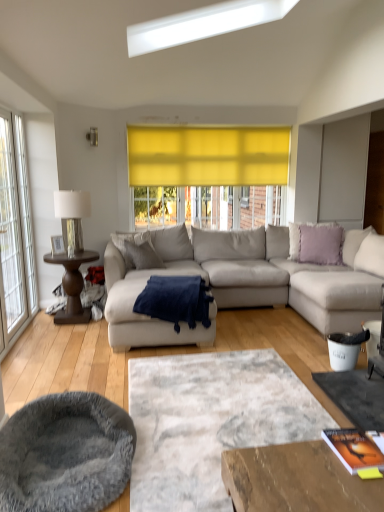
Identify the location of metallic silver lamp at left. The image size is (384, 512). (72, 215).

Image resolution: width=384 pixels, height=512 pixels. What do you see at coordinates (72, 286) in the screenshot?
I see `brown wood side table at left` at bounding box center [72, 286].

What do you see at coordinates (138, 250) in the screenshot?
I see `gray fabric pillow at center, which is the first pillow in left-to-right order` at bounding box center [138, 250].

I want to click on navy blue plush blanket at center, so click(x=175, y=300).

Identify the location of gray plush cat bed at lower left. (65, 454).

The image size is (384, 512). What do you see at coordinates (252, 283) in the screenshot?
I see `light gray fabric couch at center` at bounding box center [252, 283].

Locate an element on the screen. metallic silver lamp at left is located at coordinates (72, 215).

Which of these two, light gray fabric couch at center or textured gray rug at center, stands taller?

With more height is light gray fabric couch at center.

In the scene shown: From the image's perspective, would you say light gray fabric couch at center is shown under textured gray rug at center?

No, from the image's perspective, light gray fabric couch at center is not below textured gray rug at center.

Is textured gray rug at center completely or partially inside light gray fabric couch at center?

Definitely not — textured gray rug at center is not inside light gray fabric couch at center.

Considering the relative sizes of brown wood side table at left and gray fabric pillow at center, which is the 2th pillow from right to left, in the image provided, is brown wood side table at left bigger than gray fabric pillow at center, which is the 2th pillow from right to left,?

Yes.

Is point (60, 262) closer to viewer compared to point (132, 242)?

Yes, it is in front of point (132, 242).

In the scene shown: How different are the orientations of brown wood side table at left and gray fabric pillow at center, which is the 2th pillow from right to left, in degrees?

The angular difference between brown wood side table at left and gray fabric pillow at center, which is the 2th pillow from right to left, is 29.4 degrees.

Image resolution: width=384 pixels, height=512 pixels. I want to click on pillow that is the 1st object located behind the brown wood side table at left, so click(x=138, y=250).

Is clear glass window at left bigger than lavender soft cushion at upper right, the 1th pillow in the right-to-left sequence?

Indeed, clear glass window at left has a larger size compared to lavender soft cushion at upper right, the 1th pillow in the right-to-left sequence.

Is clear glass window at left positioned with its back to lavender soft cushion at upper right, the 1th pillow in the right-to-left sequence?

That's not correct — clear glass window at left is not looking away from lavender soft cushion at upper right, the 1th pillow in the right-to-left sequence.

Is clear glass window at left positioned far away from lavender soft cushion at upper right, the 1th pillow in the right-to-left sequence?

Yes, clear glass window at left and lavender soft cushion at upper right, the 1th pillow in the right-to-left sequence, are quite far apart.

From a real-world perspective, is clear glass window at left located higher than lavender soft cushion at upper right, the 1th pillow in the right-to-left sequence?

Yes.

Can we say clear glass window at left lies outside navy blue plush blanket at center?

Yes, clear glass window at left is outside of navy blue plush blanket at center.

From a real-world perspective, is clear glass window at left below navy blue plush blanket at center?

Incorrect, from a real-world perspective, clear glass window at left is higher than navy blue plush blanket at center.

Which point is more forward, (x=0, y=203) or (x=204, y=298)?

Positioned in front is point (x=204, y=298).

Considering the sizes of objects clear glass window at left and navy blue plush blanket at center in the image provided, who is smaller, clear glass window at left or navy blue plush blanket at center?

clear glass window at left.

Is lavender soft cushion at upper right, marked as the 2th pillow in a left-to-right arrangement, taller or shorter than clear glass window at left?

Clearly, lavender soft cushion at upper right, marked as the 2th pillow in a left-to-right arrangement, is shorter compared to clear glass window at left.

In the scene shown: From a real-world perspective, is lavender soft cushion at upper right, the 1th pillow in the right-to-left sequence, physically located above or below clear glass window at left?

In terms of real-world spatial position, lavender soft cushion at upper right, the 1th pillow in the right-to-left sequence, is below clear glass window at left.

Are lavender soft cushion at upper right, marked as the 2th pillow in a left-to-right arrangement, and clear glass window at left making contact?

lavender soft cushion at upper right, marked as the 2th pillow in a left-to-right arrangement, is not next to clear glass window at left, and they're not touching.

From the picture: Is light gray fabric couch at center situated inside clear glass window at left or outside?

light gray fabric couch at center lies outside clear glass window at left.

From the image's perspective, relative to clear glass window at left, is light gray fabric couch at center above or below?

light gray fabric couch at center is below clear glass window at left.

Can you confirm if light gray fabric couch at center is wider than clear glass window at left?

Indeed, light gray fabric couch at center has a greater width compared to clear glass window at left.

Between light gray fabric couch at center and clear glass window at left, which one appears on the left side from the viewer's perspective?

Positioned to the left is clear glass window at left.

How distant is lavender soft cushion at upper right, the 1th pillow in the right-to-left sequence, from brown wood side table at left?

The distance of lavender soft cushion at upper right, the 1th pillow in the right-to-left sequence, from brown wood side table at left is 8.37 feet.

Locate an element on the screen. the 2nd pillow above the brown wood side table at left (from the image's perspective) is located at coordinates (320, 244).

Which of these two, lavender soft cushion at upper right, marked as the 2th pillow in a left-to-right arrangement, or brown wood side table at left, stands shorter?

Standing shorter between the two is lavender soft cushion at upper right, marked as the 2th pillow in a left-to-right arrangement.

The width and height of the screenshot is (384, 512). I want to click on plain below the light gray fabric couch at center (from the image's perspective), so click(210, 422).

Find the location of a particular element. The image size is (384, 512). coffee table in front of the gray fabric pillow at center, which is the first pillow in left-to-right order is located at coordinates (72, 286).

Which object lies nearer to the anchor point gray plush cat bed at lower left, light gray fabric couch at center or navy blue plush blanket at center?

navy blue plush blanket at center.

Considering their positions, is light gray fabric couch at center positioned closer to brown wood side table at left than gray plush cat bed at lower left?

light gray fabric couch at center.

Based on their spatial positions, is metallic silver lamp at left or navy blue plush blanket at center closer to gray fabric pillow at center, which is the first pillow in left-to-right order?

metallic silver lamp at left lies closer to gray fabric pillow at center, which is the first pillow in left-to-right order, than the other object.

From the picture: Based on their spatial positions, is lavender soft cushion at upper right, the 1th pillow in the right-to-left sequence, or navy blue plush blanket at center closer to gray plush cat bed at lower left?

navy blue plush blanket at center is closer to gray plush cat bed at lower left.

Estimate the real-world distances between objects in this image. Which object is closer to light gray fabric couch at center, gray plush cat bed at lower left or navy blue plush blanket at center?

navy blue plush blanket at center is positioned closer to the anchor light gray fabric couch at center.

Estimate the real-world distances between objects in this image. Which object is closer to metallic silver lamp at left, clear glass window at left or brown wood side table at left?

Based on the image, brown wood side table at left appears to be nearer to metallic silver lamp at left.

From the image, which object appears to be farther from gray plush cat bed at lower left, textured gray rug at center or lavender soft cushion at upper right, marked as the 2th pillow in a left-to-right arrangement?

The object further to gray plush cat bed at lower left is lavender soft cushion at upper right, marked as the 2th pillow in a left-to-right arrangement.

Which object lies nearer to the anchor point navy blue plush blanket at center, textured gray rug at center or clear glass window at left?

Among the two, textured gray rug at center is located nearer to navy blue plush blanket at center.

At what (x,y) coordinates should I click in order to perform the action: click on studio couch between gray plush cat bed at lower left and gray fabric pillow at center, which is the 2th pillow from right to left, in the front-back direction. Please return your answer as a coordinate pair (x, y). This screenshot has height=512, width=384. Looking at the image, I should click on (252, 283).

The image size is (384, 512). I want to click on coffee table positioned between textured gray rug at center and gray fabric pillow at center, which is the 2th pillow from right to left, from near to far, so click(x=72, y=286).

Find the location of a particular element. The image size is (384, 512). blanket between brown wood side table at left and light gray fabric couch at center from left to right is located at coordinates (175, 300).

Locate an element on the screen. The width and height of the screenshot is (384, 512). pillow between clear glass window at left and lavender soft cushion at upper right, marked as the 2th pillow in a left-to-right arrangement is located at coordinates (138, 250).